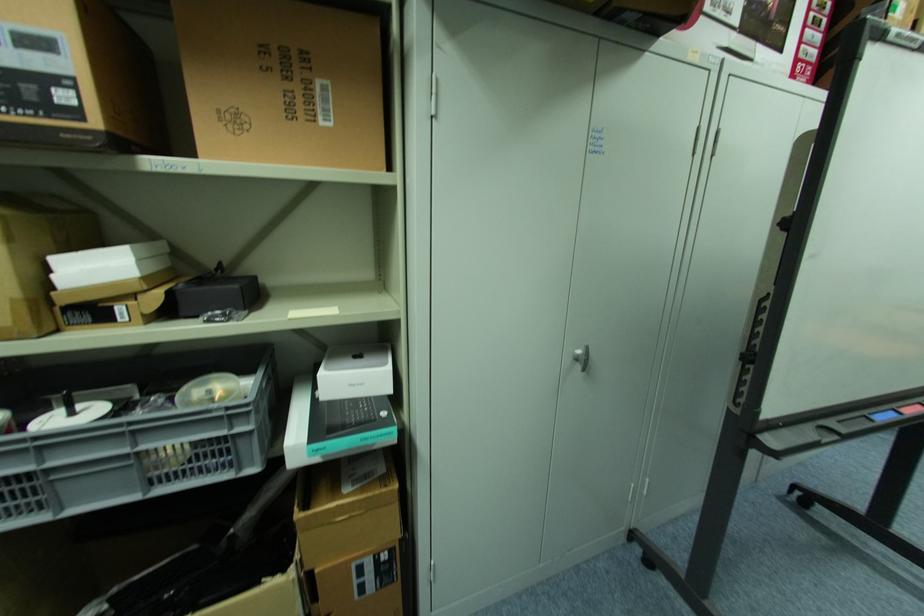
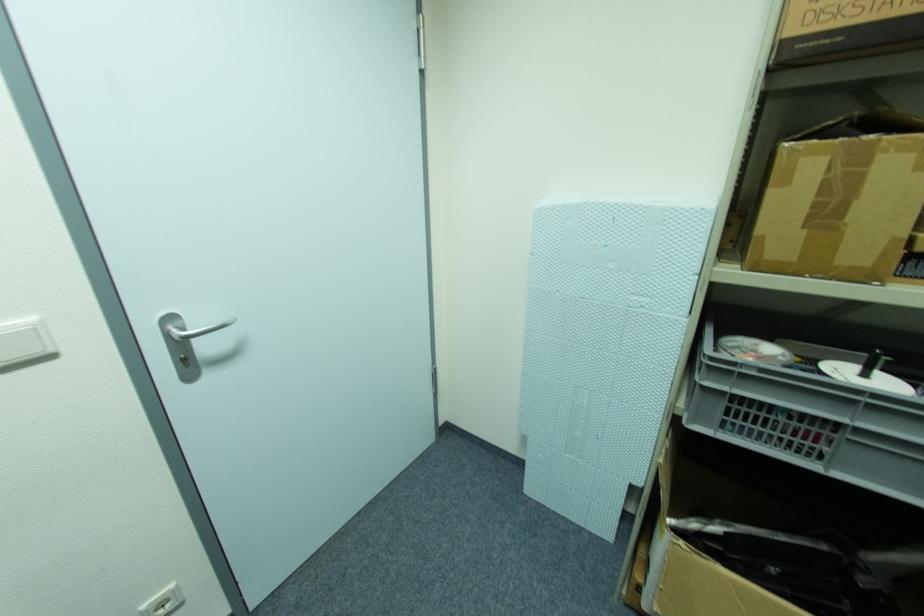
Where in the second image is the point corresponding to point 71,413 from the first image?

(867, 376)